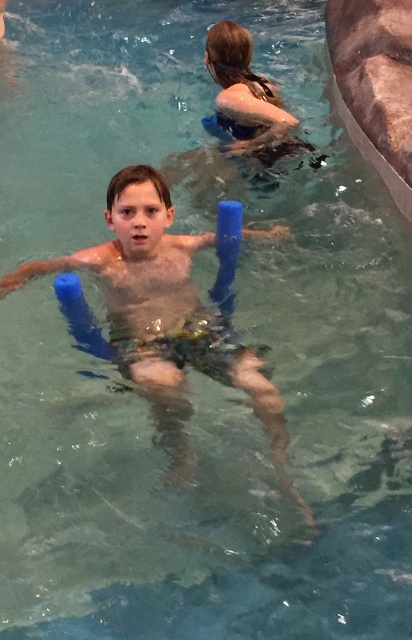
Who is taller, blue foam floaties at center or blue rubber float at upper center?

blue foam floaties at center

Who is shorter, blue foam floaties at center or blue rubber float at upper center?

blue rubber float at upper center

Is point (243, 228) less distant than point (281, 128)?

Yes, point (243, 228) is in front of point (281, 128).

At what (x,y) coordinates should I click in order to perform the action: click on blue foam floaties at center. Please return your answer as a coordinate pair (x, y). Looking at the image, I should click on (166, 317).